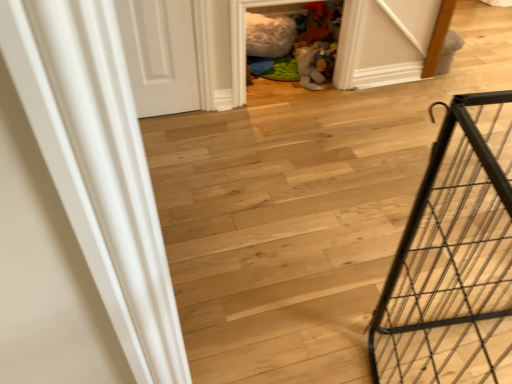
Question: In the image, is white matte door at upper left positioned in front of or behind wooden floor at center?

Choices:
 (A) front
 (B) behind

Answer: (B)

Question: Is white matte door at upper left inside or outside of wooden floor at center?

Choices:
 (A) outside
 (B) inside

Answer: (A)

Question: Estimate the real-world distances between objects in this image. Which object is closer to the black metal cage at right?

Choices:
 (A) wooden floor at center
 (B) white matte door at upper left

Answer: (A)

Question: Which object is the closest to the black metal cage at right?

Choices:
 (A) white matte door at upper left
 (B) wooden floor at center

Answer: (B)